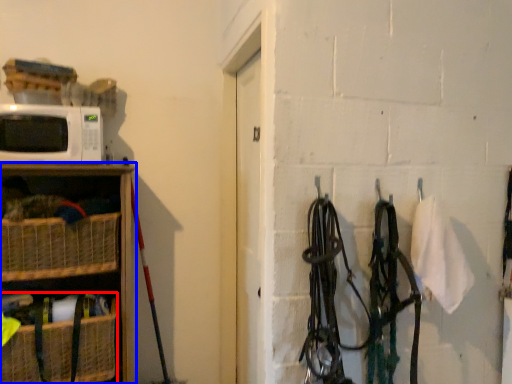
Question: Which object appears closest to the camera in this image, basket (highlighted by a red box) or shelf (highlighted by a blue box)?

Choices:
 (A) basket
 (B) shelf

Answer: (B)